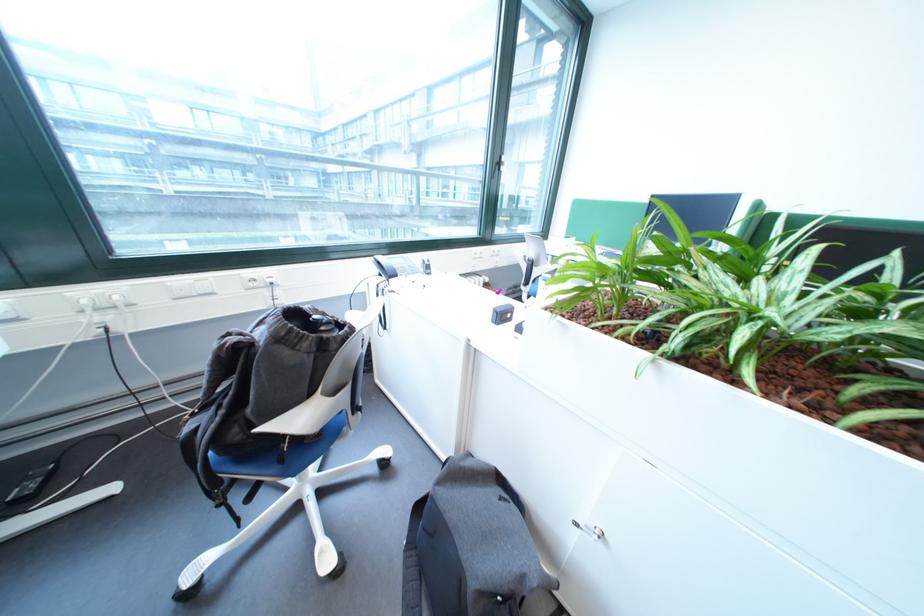
Find where to sit the blue chair sitting surface. Please return your answer as a coordinate pair (x, y).

(301, 455)